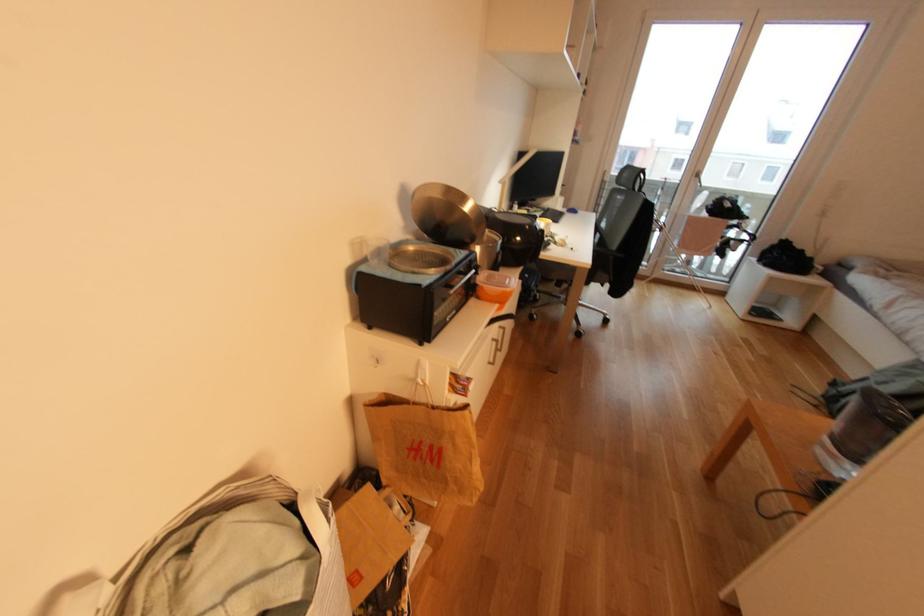
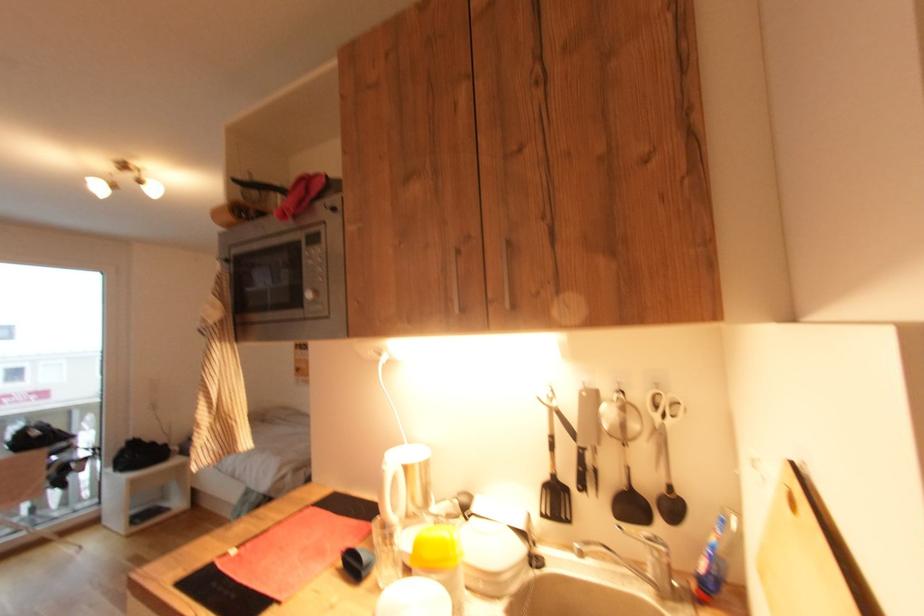
Question: The camera is either moving clockwise (left) or counter-clockwise (right) around the object. The first image is from the beginning of the video and the second image is from the end. Is the camera moving left or right when shooting the video?

Choices:
 (A) Left
 (B) Right

Answer: (A)